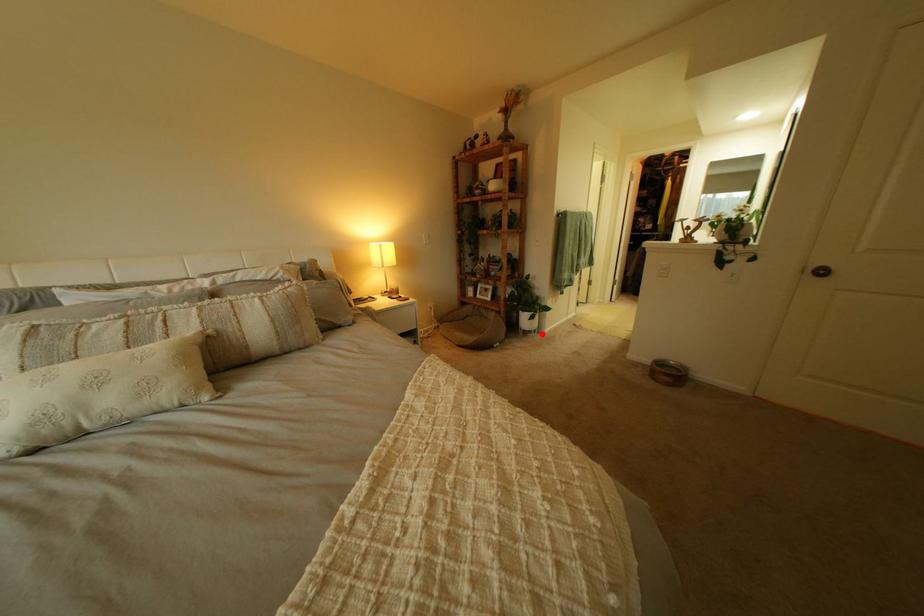
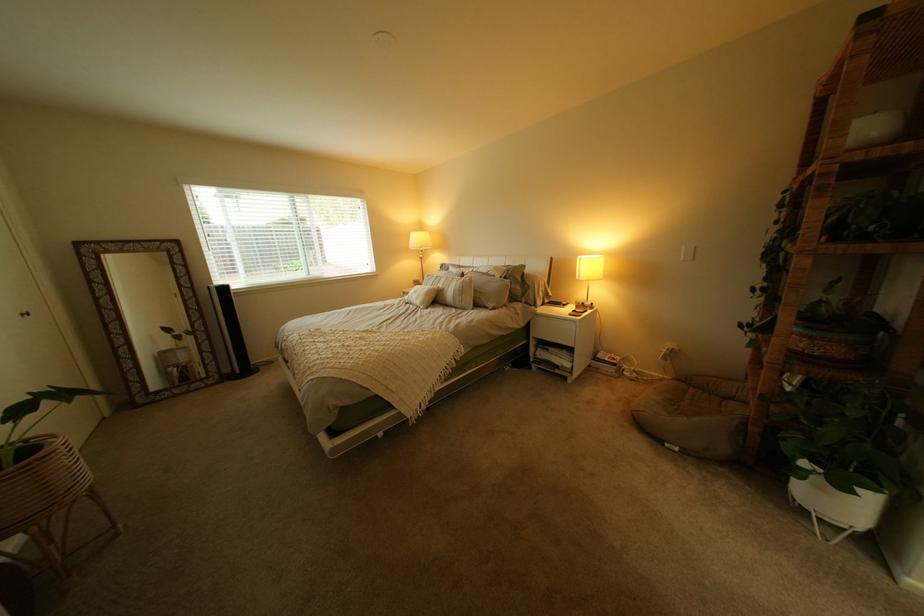
Question: A red point is marked in image1. In image2, is the corresponding 3D point closer to the camera or farther? Reply with the corresponding letter.

Choices:
 (A) The corresponding 3D point is closer.
 (B) The corresponding 3D point is farther.

Answer: (B)